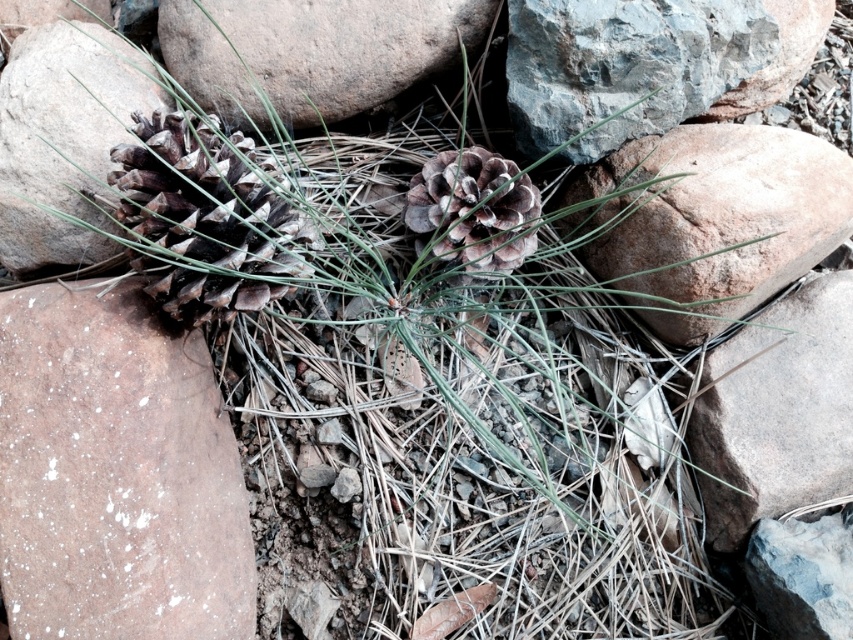
Question: Is gray rough rock at right bigger than brown rough rock at center-left?

Choices:
 (A) yes
 (B) no

Answer: (B)

Question: Which point is farther to the camera?

Choices:
 (A) (659, 65)
 (B) (456, 198)
 (C) (790, 0)

Answer: (C)

Question: Among these points, which one is nearest to the camera?

Choices:
 (A) (421, 0)
 (B) (466, 176)
 (C) (791, 244)

Answer: (B)

Question: Is speckled brown rock at lower left smaller than smooth gray rock at upper right?

Choices:
 (A) no
 (B) yes

Answer: (A)

Question: Can you confirm if speckled brown rock at lower left is smaller than gray rough rock at right?

Choices:
 (A) yes
 (B) no

Answer: (B)

Question: Which point is farther to the camera?

Choices:
 (A) gray rough rock at upper center
 (B) brown textured pine cone at center
 (C) brown rough rock at center-left
 (D) gray rough rock at right

Answer: (D)